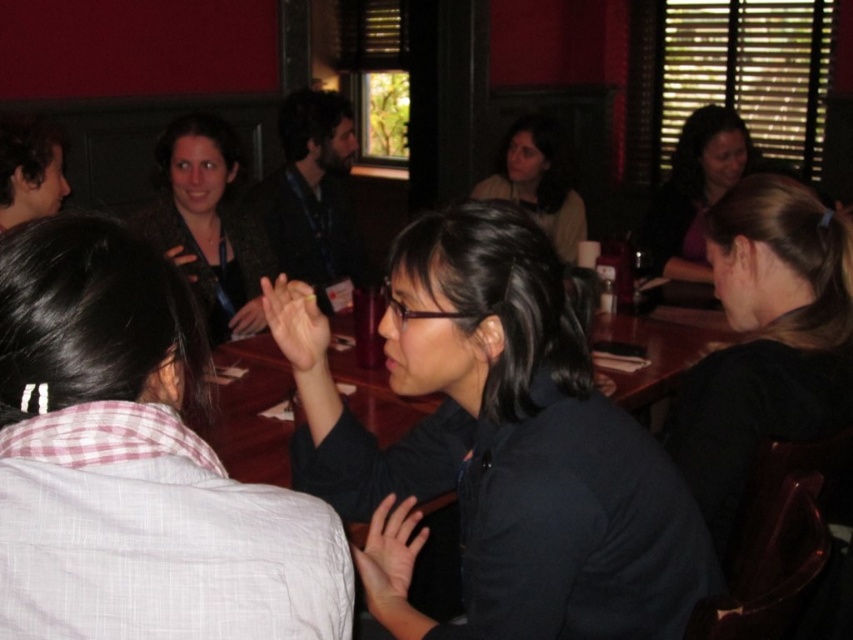
You are a photographer trying to capture a group photo of the people around the table. You want to ensure that the black matte shirt at center and the black matte shirt at right are both clearly visible in the frame. Given their heights, which of the two shirts should you position closer to the camera to avoid one blocking the other?

The black matte shirt at center is shorter than the black matte shirt at right. To prevent the taller shirt from blocking the shorter one, position the black matte shirt at center closer to the camera.

You are a photographer standing in the room. You want to take a photo of both the black matte shirt at center and the black matte shirt at right without any obstructions. Given that your camera has a maximum focus range of 20 inches, will you be able to capture both shirts in focus at the same time?

The black matte shirt at center and black matte shirt at right are 21.46 inches apart from each other. Since the distance between them exceeds the camera maximum focus range of 20 inches, you won

You are standing at the entrance of the room. You need to locate the matte purple shirt at upper right. Based on the coordinates provided, in which direction should you look to find it?

You should look towards the upper right direction to find the matte purple shirt at upper right, as it is located at point [694,192].